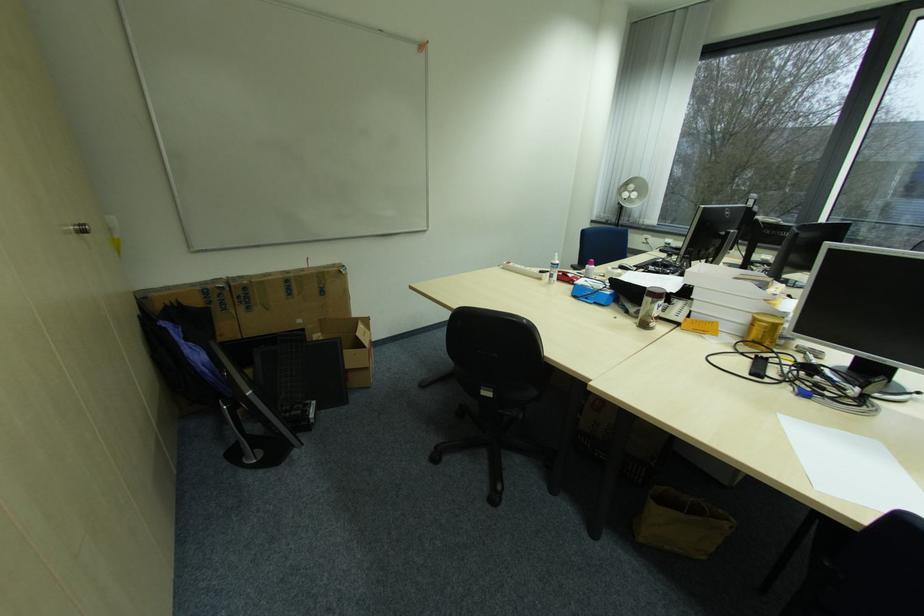
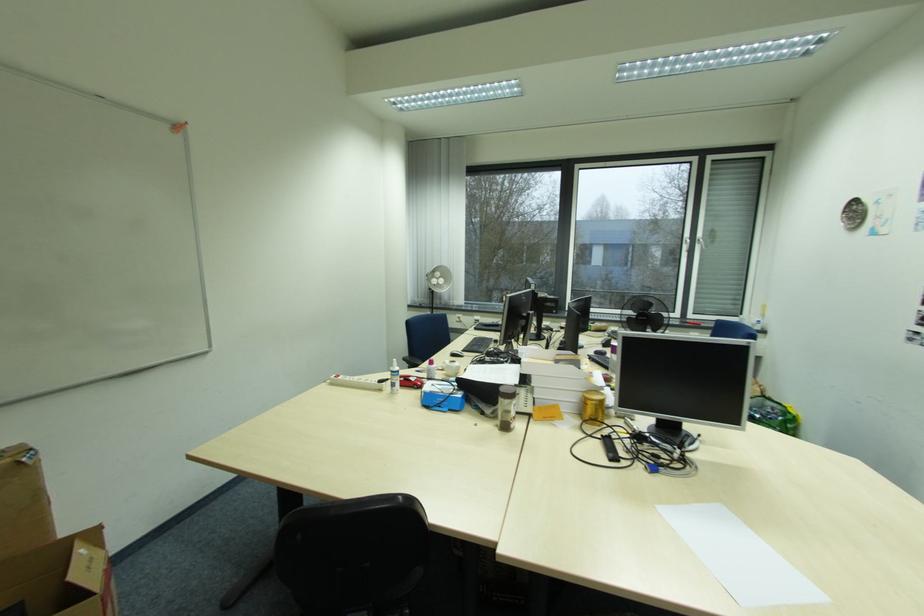
Question: The first image is from the beginning of the video and the second image is from the end. How did the camera likely rotate when shooting the video?

Choices:
 (A) Left
 (B) Right
 (C) Up
 (D) Down

Answer: (B)